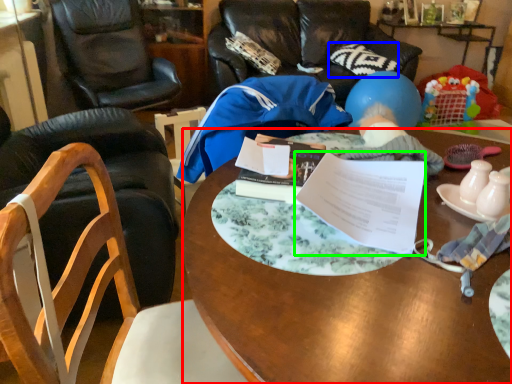
Question: Which is farther away from desk (highlighted by a red box)? pillow (highlighted by a blue box) or document (highlighted by a green box)?

Choices:
 (A) pillow
 (B) document

Answer: (A)